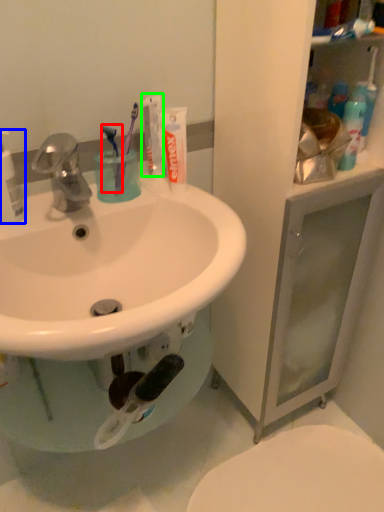
Question: Which is nearer to the toothbrush (highlighted by a red box)? cleaning product (highlighted by a blue box) or toothpaste (highlighted by a green box).

Choices:
 (A) cleaning product
 (B) toothpaste

Answer: (B)